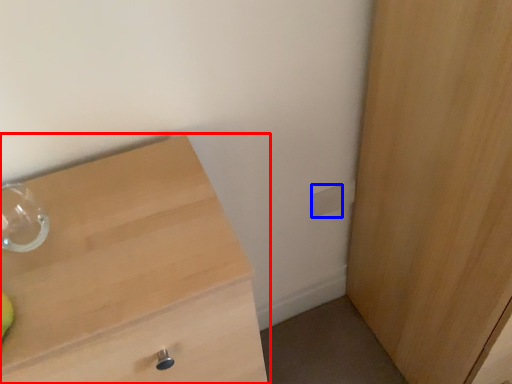
Question: Which of the following is the closest to the observer, chest of drawers (highlighted by a red box) or electric outlet (highlighted by a blue box)?

Choices:
 (A) chest of drawers
 (B) electric outlet

Answer: (A)